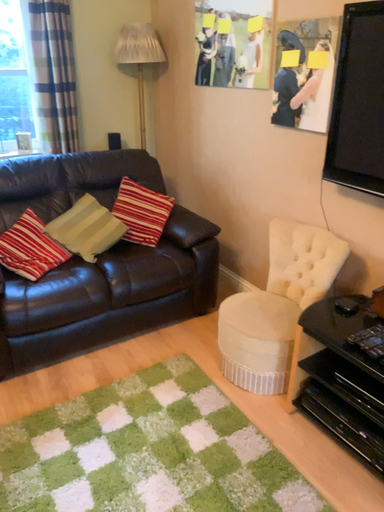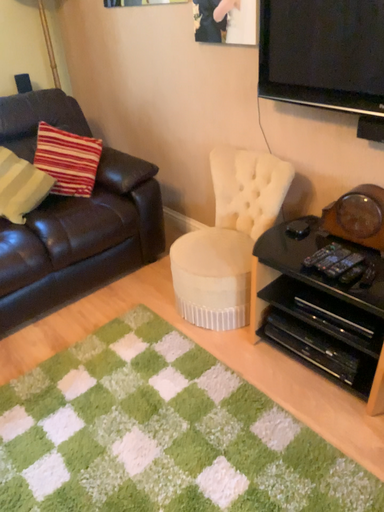
Question: How did the camera likely rotate when shooting the video?

Choices:
 (A) rotated right
 (B) rotated left

Answer: (A)